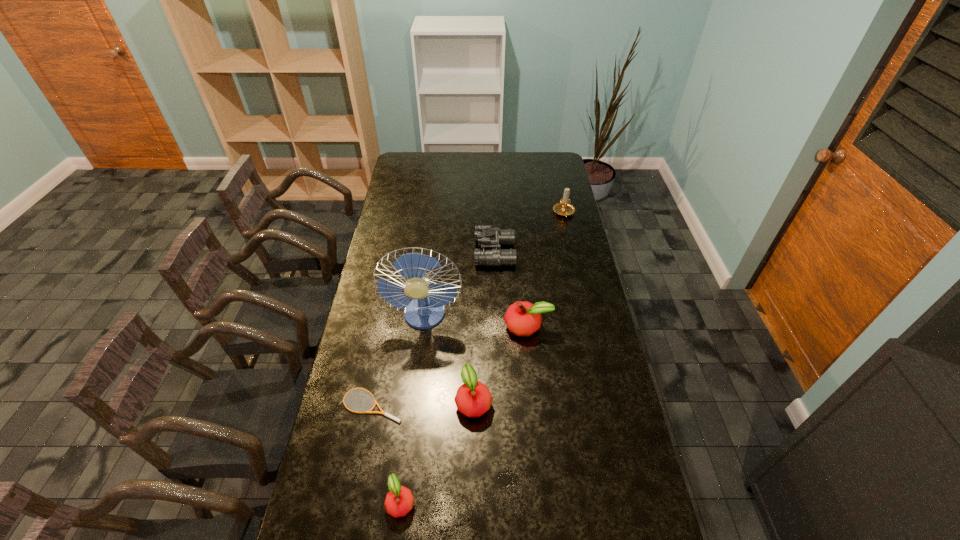
I want to click on fan at the left edge, so click(423, 312).

At what (x,y) coordinates should I click in order to perform the action: click on tennis racket at the left edge. Please return your answer as a coordinate pair (x, y). The width and height of the screenshot is (960, 540). Looking at the image, I should click on (384, 413).

Image resolution: width=960 pixels, height=540 pixels. What are the coordinates of `object present at the right edge` in the screenshot? It's located at (564, 208).

In the image, there is a desktop. At what (x,y) coordinates should I click in order to perform the action: click on vacant space at the far edge. Please return your answer as a coordinate pair (x, y). Looking at the image, I should click on (482, 162).

In the image, there is a desktop. Identify the location of vacant space at the near edge. This screenshot has height=540, width=960. (540, 519).

This screenshot has width=960, height=540. In the image, there is a desktop. What are the coordinates of `vacant area at the left edge` in the screenshot? It's located at (353, 497).

Identify the location of vacant space at the right edge. (591, 326).

Where is `vacant region at the far left corner of the desktop`? Image resolution: width=960 pixels, height=540 pixels. vacant region at the far left corner of the desktop is located at coordinates (408, 160).

Where is `blank region between the fan and the farthest apple`? This screenshot has height=540, width=960. blank region between the fan and the farthest apple is located at coordinates (476, 321).

Image resolution: width=960 pixels, height=540 pixels. In order to click on vacant space that is in between the fan and the shortest apple in this screenshot , I will do `click(413, 409)`.